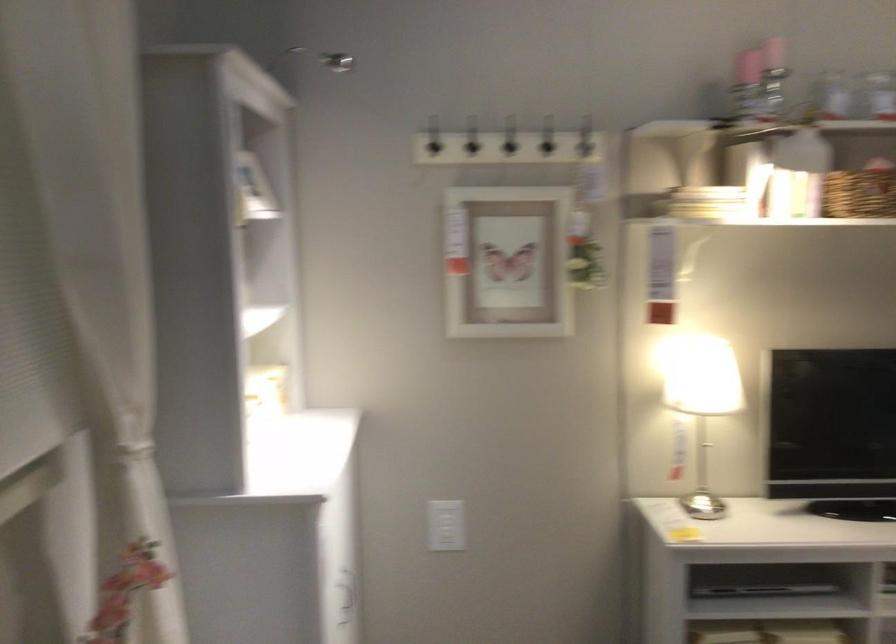
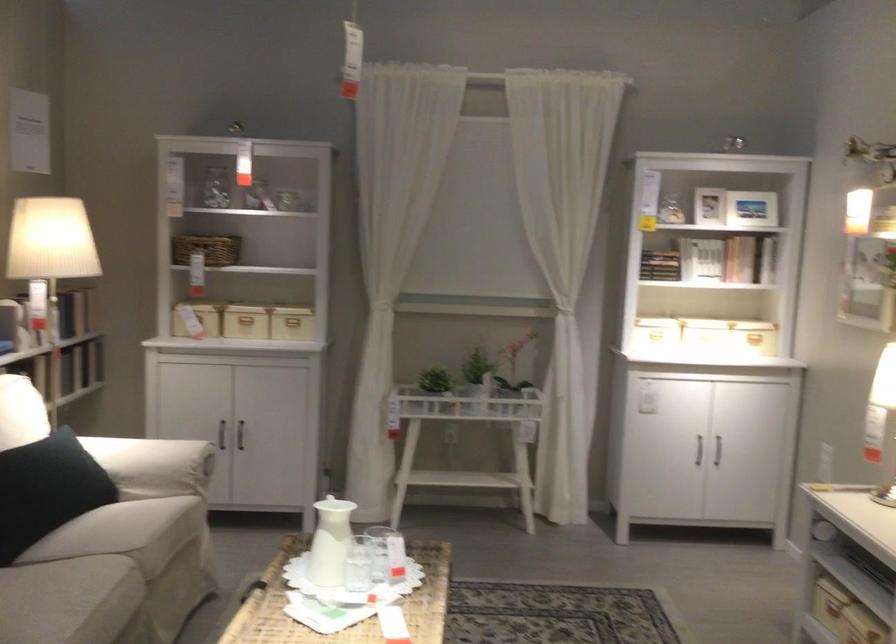
In the second image, find the point that corresponds to (x=323, y=433) in the first image.

(755, 339)